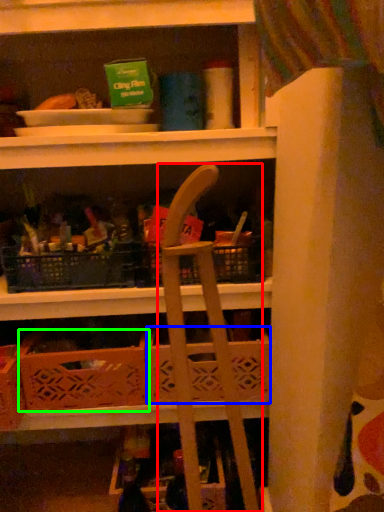
Question: Considering the real-world distances, which object is closest to folding chair (highlighted by a red box)? basket (highlighted by a blue box) or crate (highlighted by a green box).

Choices:
 (A) basket
 (B) crate

Answer: (A)